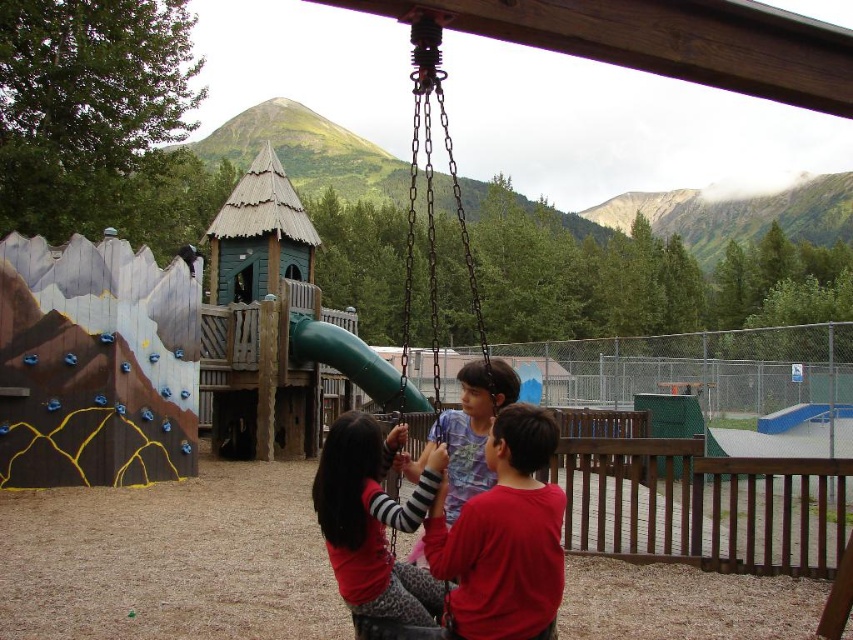
Between matte red shirt at center and light blue striped shirt at center, which one has more height?

Standing taller between the two is matte red shirt at center.

Between point (373, 424) and point (456, 456), which one is positioned in front?

Point (373, 424) is in front.

Is point (363, 584) behind point (517, 388)?

No, it is in front of (517, 388).

The height and width of the screenshot is (640, 853). Find the location of `matte red shirt at center`. matte red shirt at center is located at coordinates (374, 518).

How far apart are light blue striped shirt at center and green rubber slide at center?

light blue striped shirt at center and green rubber slide at center are 12.16 meters apart from each other.

Does light blue striped shirt at center appear over green rubber slide at center?

Indeed, light blue striped shirt at center is positioned over green rubber slide at center.

You are a GUI agent. You are given a task and a screenshot of the screen. Output one action in this format:
    pyautogui.click(x=<x>, y=<y>)
    Task: Click on the light blue striped shirt at center
    
    Given the screenshot: What is the action you would take?
    pyautogui.click(x=473, y=428)

Can you confirm if red cotton shirt at center is positioned to the right of light blue striped shirt at center?

In fact, red cotton shirt at center is to the left of light blue striped shirt at center.

What do you see at coordinates (505, 538) in the screenshot? I see `red cotton shirt at center` at bounding box center [505, 538].

Locate an element on the screen. red cotton shirt at center is located at coordinates (505, 538).